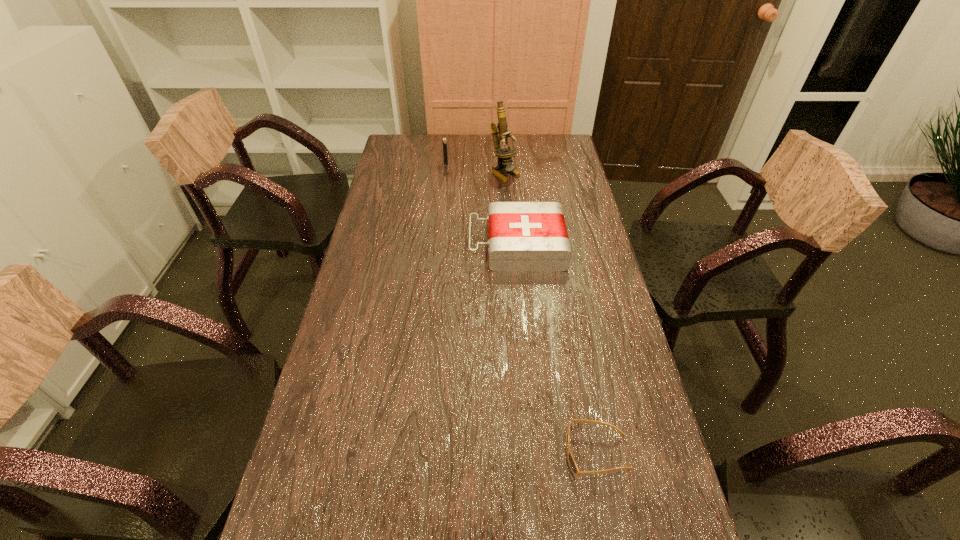
Locate an element on the screen. free location located 0.350m on the front side of the second nearest object is located at coordinates (363, 245).

This screenshot has width=960, height=540. I want to click on vacant space located on the front side of the second nearest object, so click(x=439, y=245).

Locate an element on the screen. vacant region located on the front-facing side of the sunglasses is located at coordinates (411, 453).

The height and width of the screenshot is (540, 960). I want to click on blank space located on the front-facing side of the sunglasses, so click(434, 453).

Locate an element on the screen. The width and height of the screenshot is (960, 540). free space located on the front-facing side of the sunglasses is located at coordinates (447, 453).

At what (x,y) coordinates should I click in order to perform the action: click on object located at the far edge. Please return your answer as a coordinate pair (x, y). The height and width of the screenshot is (540, 960). Looking at the image, I should click on pos(444,140).

At what (x,y) coordinates should I click in order to perform the action: click on the first-aid kit that is at the right edge. Please return your answer as a coordinate pair (x, y). This screenshot has width=960, height=540. Looking at the image, I should click on tap(523, 236).

Where is `sunglasses that is at the right edge`? The width and height of the screenshot is (960, 540). sunglasses that is at the right edge is located at coordinates (572, 463).

Where is `free space at the far edge of the desktop`? Image resolution: width=960 pixels, height=540 pixels. free space at the far edge of the desktop is located at coordinates (478, 145).

Find the location of a particular element. This screenshot has height=540, width=960. free location at the left edge is located at coordinates (343, 386).